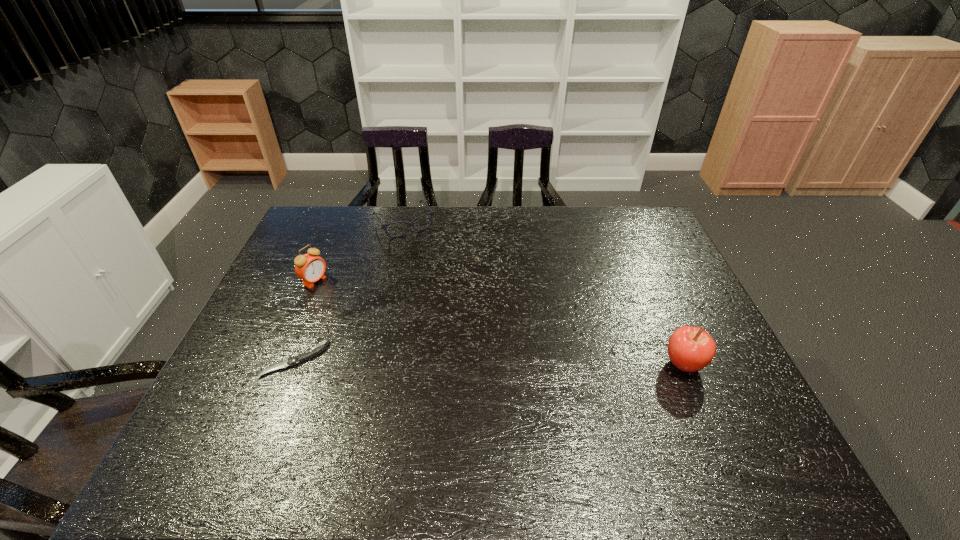
Where is `vacant area located on the face of the alarm clock`? vacant area located on the face of the alarm clock is located at coordinates (359, 306).

What are the coordinates of `vacant space located 0.310m on the face of the alarm clock` in the screenshot? It's located at (401, 328).

Where is `free space located on the face of the alarm clock`? Image resolution: width=960 pixels, height=540 pixels. free space located on the face of the alarm clock is located at coordinates (387, 321).

I want to click on object that is positioned at the far edge, so click(x=409, y=224).

Find the location of a particular element. Image resolution: width=960 pixels, height=540 pixels. pocketknife situated at the left edge is located at coordinates (310, 353).

In order to click on alarm clock that is at the left edge in this screenshot , I will do `click(310, 268)`.

You are a GUI agent. You are given a task and a screenshot of the screen. Output one action in this format:
    pyautogui.click(x=<x>, y=<y>)
    Task: Click on the object at the right edge
    
    Given the screenshot: What is the action you would take?
    pyautogui.click(x=690, y=349)

You are a GUI agent. You are given a task and a screenshot of the screen. Output one action in this format:
    pyautogui.click(x=<x>, y=<y>)
    Task: Click on the free region at the far edge of the desktop
    This screenshot has height=540, width=960.
    Given the screenshot: What is the action you would take?
    pyautogui.click(x=394, y=231)

This screenshot has width=960, height=540. In order to click on vacant region at the near edge of the desktop in this screenshot , I will do `click(651, 397)`.

Identify the location of vacant space at the left edge of the desktop. (274, 389).